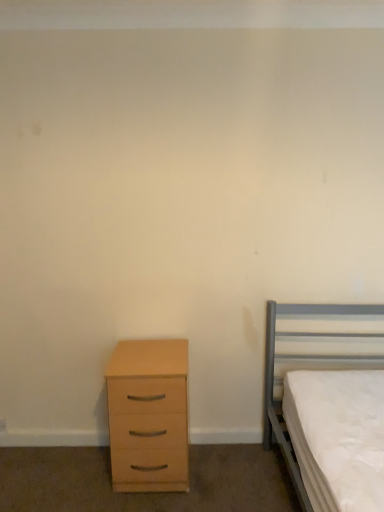
Where is `light wood/veneer chest of drawers at lower left`? Image resolution: width=384 pixels, height=512 pixels. light wood/veneer chest of drawers at lower left is located at coordinates (148, 415).

What do you see at coordinates (148, 415) in the screenshot? I see `light wood/veneer chest of drawers at lower left` at bounding box center [148, 415].

Describe the element at coordinates (302, 361) in the screenshot. The width and height of the screenshot is (384, 512). I see `metallic gray bed at right` at that location.

The height and width of the screenshot is (512, 384). Find the location of `metallic gray bed at right`. metallic gray bed at right is located at coordinates (302, 361).

Where is `light wood/veneer chest of drawers at lower left`? The width and height of the screenshot is (384, 512). light wood/veneer chest of drawers at lower left is located at coordinates (148, 415).

Can you confirm if metallic gray bed at right is positioned to the left of light wood/veneer chest of drawers at lower left?

No, metallic gray bed at right is not to the left of light wood/veneer chest of drawers at lower left.

Which object is further away from the camera taking this photo, metallic gray bed at right or light wood/veneer chest of drawers at lower left?

light wood/veneer chest of drawers at lower left is further from the camera.

Considering the positions of points (375, 312) and (161, 383), is point (375, 312) farther from camera compared to point (161, 383)?

Yes, point (375, 312) is behind point (161, 383).

From the image's perspective, is metallic gray bed at right located beneath light wood/veneer chest of drawers at lower left?

Actually, metallic gray bed at right appears above light wood/veneer chest of drawers at lower left in the image.

From a real-world perspective, which object stands above the other?

metallic gray bed at right is physically above.

Which of these two, metallic gray bed at right or light wood/veneer chest of drawers at lower left, is thinner?

With smaller width is light wood/veneer chest of drawers at lower left.

Considering the sizes of objects metallic gray bed at right and light wood/veneer chest of drawers at lower left in the image provided, who is taller, metallic gray bed at right or light wood/veneer chest of drawers at lower left?

Standing taller between the two is metallic gray bed at right.

Considering the sizes of objects metallic gray bed at right and light wood/veneer chest of drawers at lower left in the image provided, who is bigger, metallic gray bed at right or light wood/veneer chest of drawers at lower left?

metallic gray bed at right.

Choose the correct answer: Is metallic gray bed at right inside light wood/veneer chest of drawers at lower left or outside it?

metallic gray bed at right is not enclosed by light wood/veneer chest of drawers at lower left.

Would you say metallic gray bed at right is a long distance from light wood/veneer chest of drawers at lower left?

No, there isn't a large distance between metallic gray bed at right and light wood/veneer chest of drawers at lower left.

Is metallic gray bed at right looking in the opposite direction of light wood/veneer chest of drawers at lower left?

No, metallic gray bed at right is not facing the opposite direction of light wood/veneer chest of drawers at lower left.

Can you tell me how much metallic gray bed at right and light wood/veneer chest of drawers at lower left differ in facing direction?

1.87 degrees separate the facing orientations of metallic gray bed at right and light wood/veneer chest of drawers at lower left.

At what (x,y) coordinates should I click in order to perform the action: click on chest of drawers below the metallic gray bed at right (from the image's perspective). Please return your answer as a coordinate pair (x, y). Looking at the image, I should click on (148, 415).

Is light wood/veneer chest of drawers at lower left to the left or to the right of metallic gray bed at right in the image?

Clearly, light wood/veneer chest of drawers at lower left is on the left of metallic gray bed at right in the image.

Between light wood/veneer chest of drawers at lower left and metallic gray bed at right, which one is positioned behind?

light wood/veneer chest of drawers at lower left is further away from the camera.

Which is behind, point (175, 418) or point (336, 333)?

The point (336, 333) is behind.

From the image's perspective, does light wood/veneer chest of drawers at lower left appear higher than metallic gray bed at right?

No, from the image's perspective, light wood/veneer chest of drawers at lower left is not above metallic gray bed at right.

From a real-world perspective, is light wood/veneer chest of drawers at lower left located higher than metallic gray bed at right?

No.

Looking at their sizes, would you say light wood/veneer chest of drawers at lower left is wider or thinner than metallic gray bed at right?

light wood/veneer chest of drawers at lower left is thinner than metallic gray bed at right.

Considering the relative sizes of light wood/veneer chest of drawers at lower left and metallic gray bed at right in the image provided, is light wood/veneer chest of drawers at lower left taller than metallic gray bed at right?

No, light wood/veneer chest of drawers at lower left is not taller than metallic gray bed at right.

Considering the relative sizes of light wood/veneer chest of drawers at lower left and metallic gray bed at right in the image provided, is light wood/veneer chest of drawers at lower left bigger than metallic gray bed at right?

No, light wood/veneer chest of drawers at lower left is not bigger than metallic gray bed at right.

Is light wood/veneer chest of drawers at lower left outside of metallic gray bed at right?

Yes.

Are light wood/veneer chest of drawers at lower left and metallic gray bed at right located far from each other?

That's not correct — light wood/veneer chest of drawers at lower left is a little close to metallic gray bed at right.

Does light wood/veneer chest of drawers at lower left turn towards metallic gray bed at right?

No, light wood/veneer chest of drawers at lower left is not oriented towards metallic gray bed at right.

How much distance is there between light wood/veneer chest of drawers at lower left and metallic gray bed at right?

light wood/veneer chest of drawers at lower left and metallic gray bed at right are 30.03 inches apart from each other.

Image resolution: width=384 pixels, height=512 pixels. What are the coordinates of `chest of drawers below the metallic gray bed at right (from the image's perspective)` in the screenshot? It's located at (148, 415).

Identify the location of bed to the right of light wood/veneer chest of drawers at lower left. (302, 361).

In the image, there is a metallic gray bed at right. Identify the location of the chest of drawers below it (from a real-world perspective). This screenshot has width=384, height=512. (148, 415).